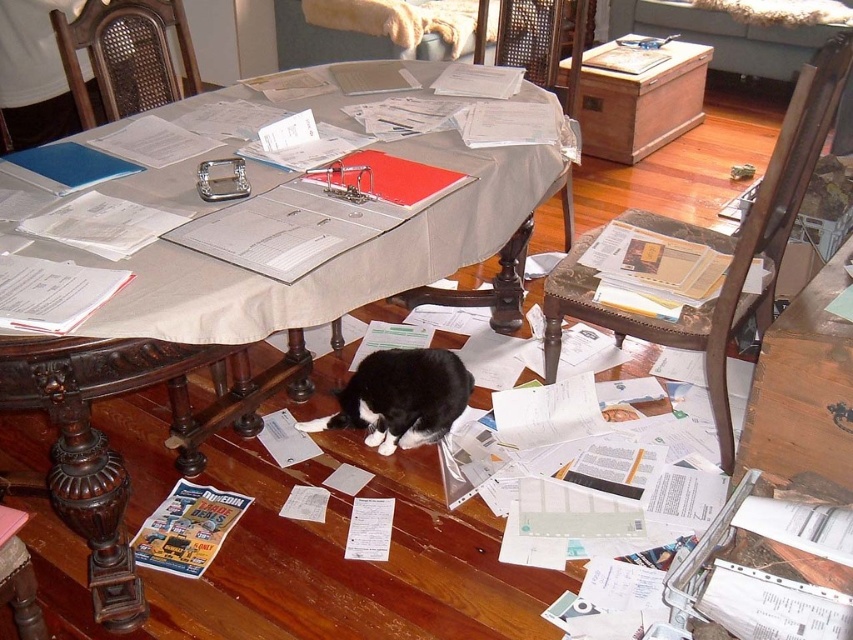
Question: Which of the following is the farthest from the observer?

Choices:
 (A) (491, 240)
 (B) (352, 406)

Answer: (B)

Question: Does smooth beige table at center appear on the left side of black fur cat at center?

Choices:
 (A) yes
 (B) no

Answer: (A)

Question: Can you confirm if smooth beige table at center is smaller than black fur cat at center?

Choices:
 (A) no
 (B) yes

Answer: (A)

Question: Is smooth beige table at center bigger than black fur cat at center?

Choices:
 (A) no
 (B) yes

Answer: (B)

Question: Among these objects, which one is nearest to the camera?

Choices:
 (A) black fur cat at center
 (B) smooth beige table at center

Answer: (B)

Question: Which point is farther from the camera taking this photo?

Choices:
 (A) tap(419, 365)
 (B) tap(270, 170)

Answer: (A)